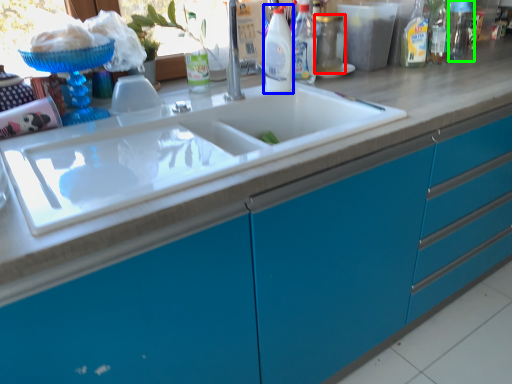
Question: Based on their relative distances, which object is farther from bottle (highlighted by a red box)? Choose from bottle (highlighted by a blue box) and bottle (highlighted by a green box).

Choices:
 (A) bottle
 (B) bottle

Answer: (B)